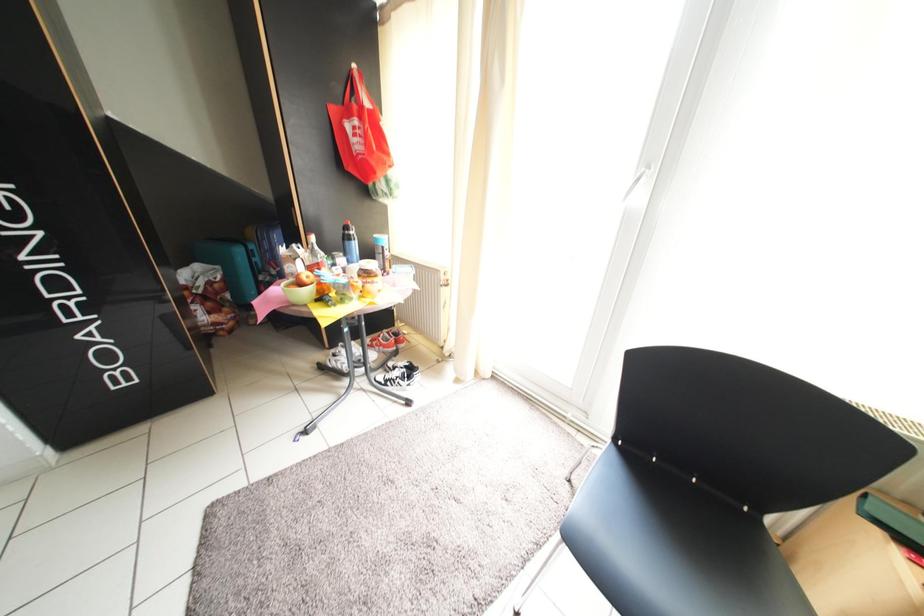
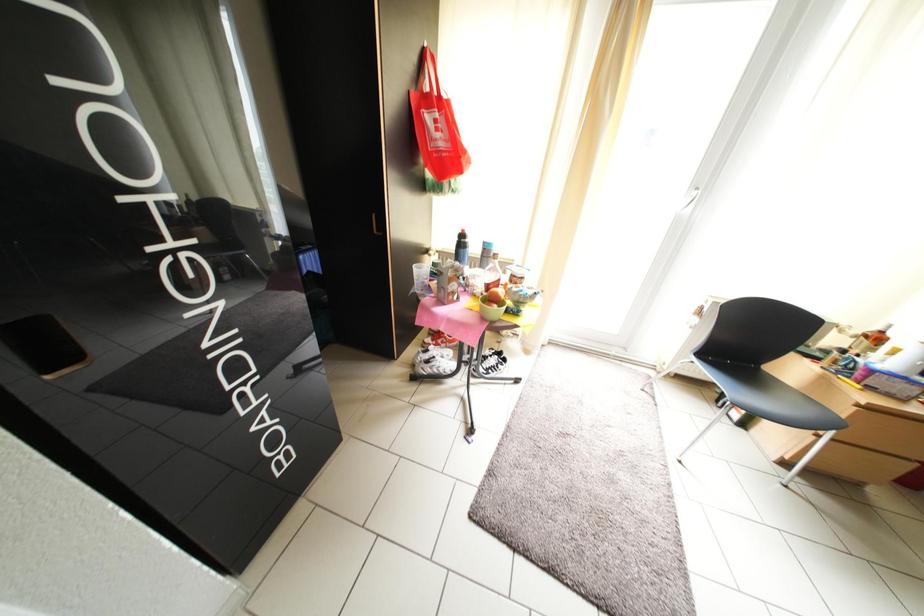
Question: The images are taken continuously from a first-person perspective. In which direction are you moving?

Choices:
 (A) Left
 (B) Right
 (C) Forward
 (D) Backward

Answer: (A)